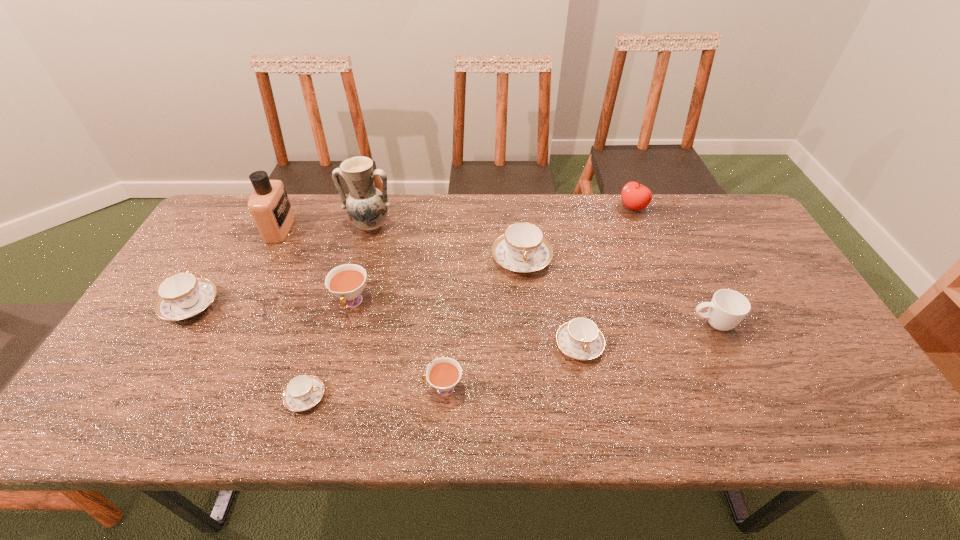
Image resolution: width=960 pixels, height=540 pixels. Find the location of `vacant point located 0.090m on the side with the handle of the second smallest blue teacup`. vacant point located 0.090m on the side with the handle of the second smallest blue teacup is located at coordinates (589, 400).

Where is `free space located 0.270m on the side with the handle of the smallest blue teacup`? free space located 0.270m on the side with the handle of the smallest blue teacup is located at coordinates (444, 396).

The image size is (960, 540). Identify the location of pottery that is at the far edge. (367, 207).

This screenshot has height=540, width=960. I want to click on perfume at the far edge, so click(x=269, y=205).

Locate an element on the screen. This screenshot has height=540, width=960. apple present at the far edge is located at coordinates (634, 196).

At what (x,y) coordinates should I click in order to perform the action: click on teacup positioned at the far edge. Please return your answer as a coordinate pair (x, y). The width and height of the screenshot is (960, 540). Looking at the image, I should click on (522, 248).

Identify the location of object that is at the left edge. The image size is (960, 540). (181, 296).

In the image, there is a desktop. At what (x,y) coordinates should I click in order to perform the action: click on free space at the far edge. Please return your answer as a coordinate pair (x, y). Looking at the image, I should click on (676, 195).

Image resolution: width=960 pixels, height=540 pixels. In the image, there is a desktop. In order to click on vacant space at the near edge in this screenshot , I will do `click(698, 433)`.

The width and height of the screenshot is (960, 540). In the image, there is a desktop. Find the location of `free region at the left edge`. free region at the left edge is located at coordinates (221, 258).